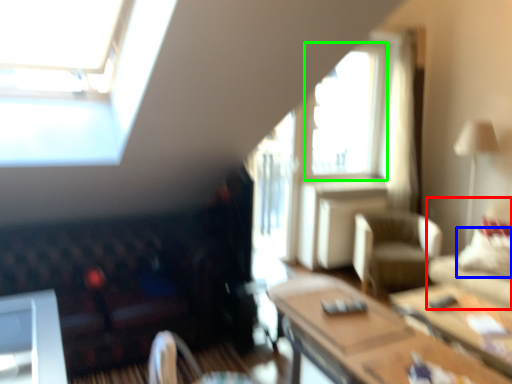
Question: Which object is the farthest from studio couch (highlighted by a red box)? Choose among these: pillow (highlighted by a blue box) or window (highlighted by a green box).

Choices:
 (A) pillow
 (B) window

Answer: (B)